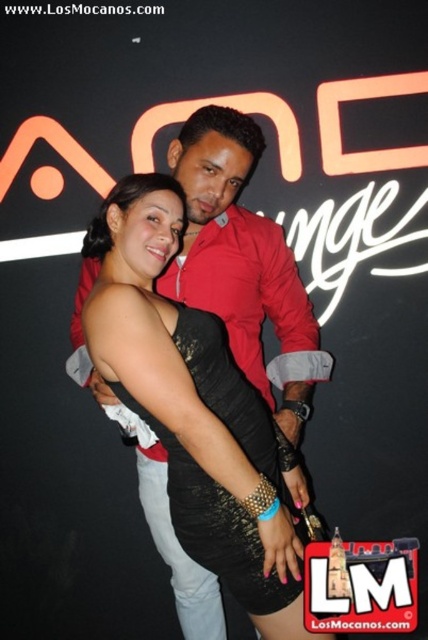
You are a photographer setting up for a photoshoot. You have two dresses, the black sequined dress at center and the black lace dress at center, placed 12.51 inches apart. The camera you are using has a minimum focus distance of 12 inches. Can you focus on both dresses simultaneously without adjusting the camera settings?

The black sequined dress at center and black lace dress at center are 12.51 inches apart. Since the camera requires a minimum focus distance of 12 inches, the 12.51 inches gap exceeds this threshold, meaning the camera cannot focus on both dresses simultaneously without adjusting the settings.

You are a photographer setting up a photo shoot. You have two dresses displayed at the center of the scene. The black sequined dress at center and the black lace dress at center. Which dress should you choose if you want the one that is wider to ensure it stands out more in the photo?

The black sequened dress at center has a larger width than the black lace dress at center, so you should choose the black sequined dress at center to ensure it stands out more in the photo.